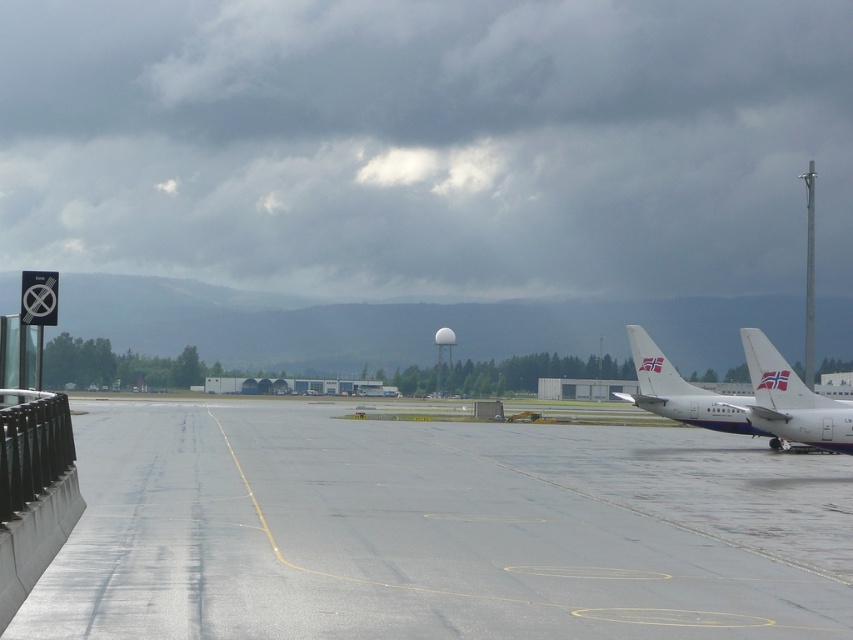
You are a pilot preparing to taxi your plane from the terminal to the runway. You see the smooth asphalt runway at center and the white matte airplane at right. Which object is nearer to you as you stand at the terminal entrance?

The smooth asphalt runway at center is closer to the viewer than the white matte airplane at right, so the runway is nearer to you.

You are a pilot taxiing your plane to the runway. You see the smooth asphalt runway at center and the white matte airplane at right. Which direction should you turn to reach the runway from the airplane?

The smooth asphalt runway at center is positioned on the left side of white matte airplane at right, so you should turn left to reach the runway from the airplane.